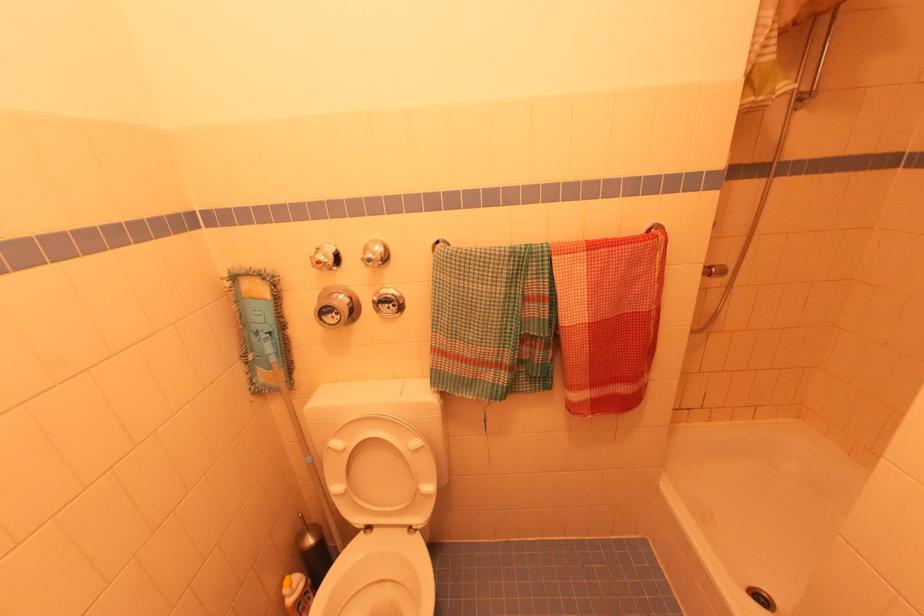
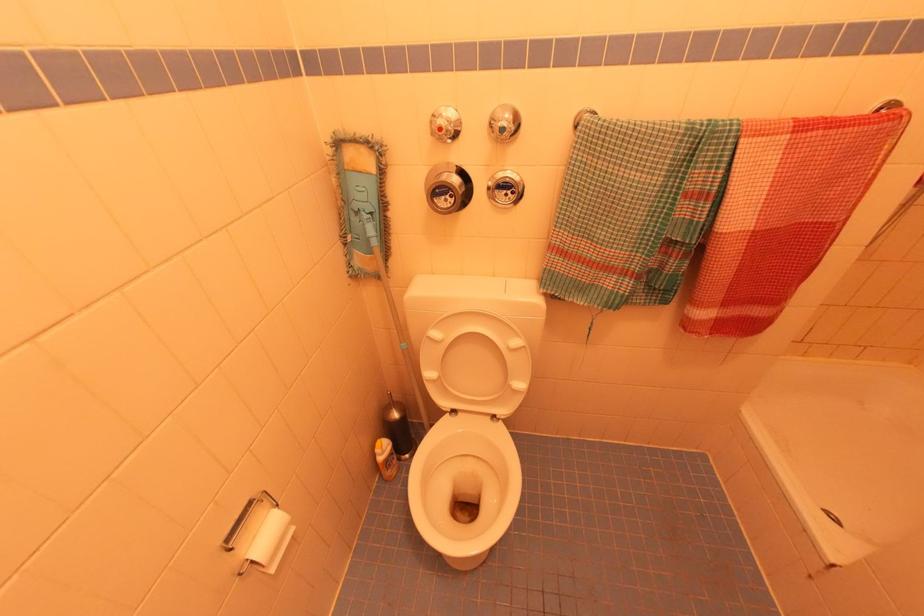
The point at (245, 365) is marked in the first image. Where is the corresponding point in the second image?

(344, 246)